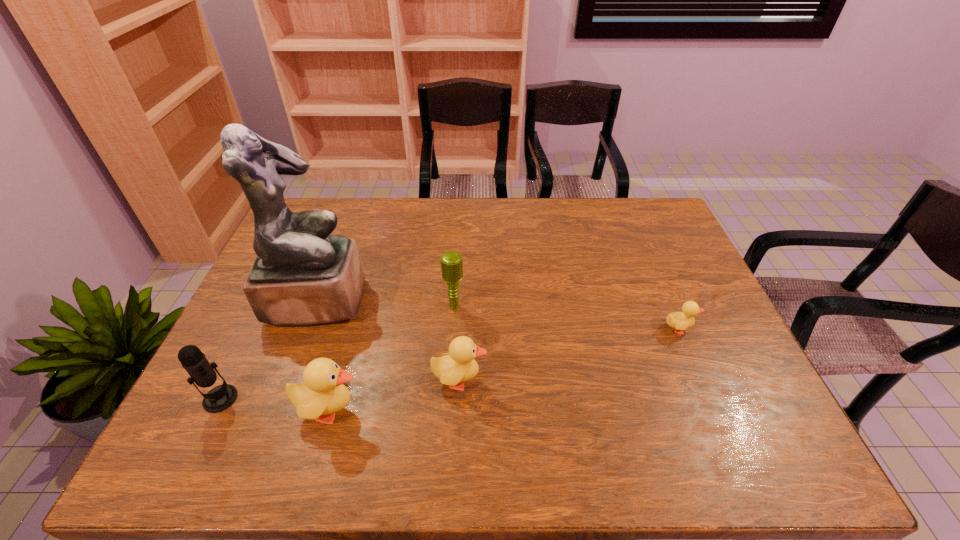
Locate an element on the screen. free space at the right edge of the desktop is located at coordinates (664, 245).

Find the location of `vacant space at the near right corner of the desktop`. vacant space at the near right corner of the desktop is located at coordinates (718, 391).

Find the location of a particular element. The height and width of the screenshot is (540, 960). free spot between the right microphone and the leftmost duckling is located at coordinates (393, 358).

Image resolution: width=960 pixels, height=540 pixels. I want to click on free space between the rightmost object and the second duckling from left to right, so click(x=569, y=354).

At what (x,y) coordinates should I click in order to perform the action: click on vacant region between the tallest object and the leftmost duckling. Please return your answer as a coordinate pair (x, y). This screenshot has height=540, width=960. Looking at the image, I should click on (324, 354).

Where is `empty location between the second duckling from left to right and the rightmost object`? The height and width of the screenshot is (540, 960). empty location between the second duckling from left to right and the rightmost object is located at coordinates (569, 354).

The width and height of the screenshot is (960, 540). What are the coordinates of `blank region between the leftmost duckling and the sculpture` in the screenshot? It's located at (324, 354).

Locate an element on the screen. free spot between the second shortest object and the rightmost duckling is located at coordinates (569, 354).

What are the coordinates of `unoccupied area between the second shortest duckling and the shortest object` in the screenshot? It's located at (569, 354).

This screenshot has width=960, height=540. Find the location of `vacant space that is in between the leftmost duckling and the farthest duckling`. vacant space that is in between the leftmost duckling and the farthest duckling is located at coordinates (505, 369).